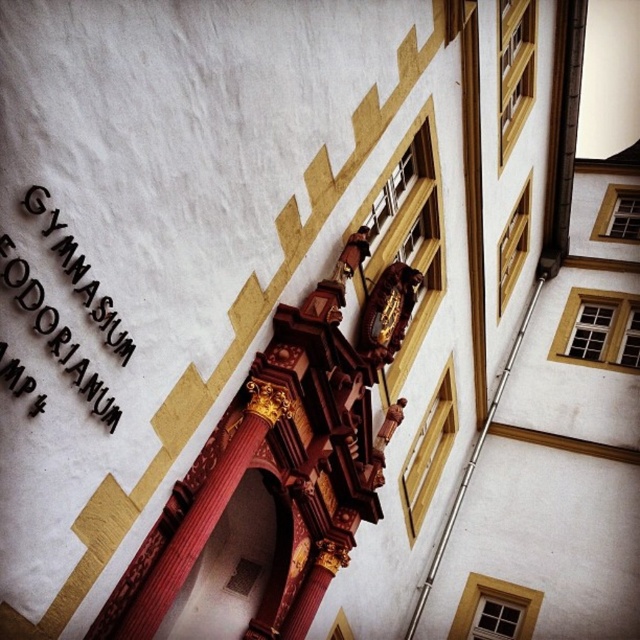
You are an architect examining the building facade. You notice the black metal sign at upper left and the gold polished wood clock at center. Which object is larger in size?

The gold polished wood clock at center is larger than the black metal sign at upper left.

You are standing in front of the building and want to read the black metal sign at upper left. Is it positioned above or below the gold polished wood clock at center?

The black metal sign at upper left is below the gold polished wood clock at center, so it is positioned below it.